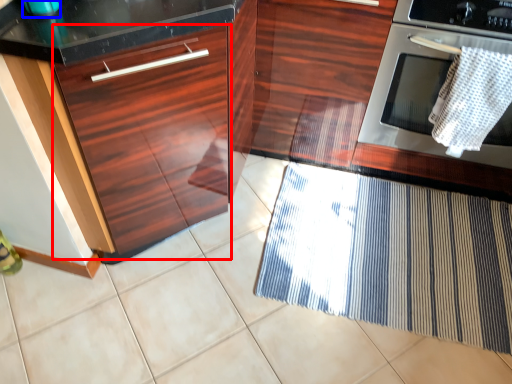
Question: Which point is further to the camera, drawer (highlighted by a red box) or appliance (highlighted by a blue box)?

Choices:
 (A) drawer
 (B) appliance

Answer: (B)